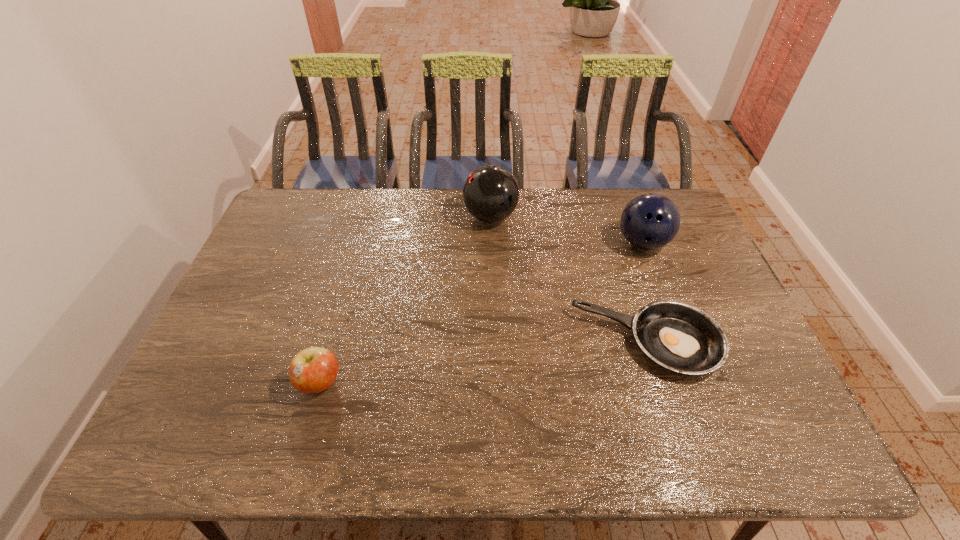
Find the location of a particular element. Image resolution: width=960 pixels, height=540 pixels. blank area located 0.200m on the left of the shortest object is located at coordinates (499, 343).

Where is `bowling ball that is at the right edge`? bowling ball that is at the right edge is located at coordinates (650, 221).

Find the location of a particular element. The image size is (960, 540). frying pan that is at the right edge is located at coordinates (680, 337).

Identify the location of object positioned at the far right corner. Image resolution: width=960 pixels, height=540 pixels. (650, 221).

The width and height of the screenshot is (960, 540). In the image, there is a desktop. In order to click on vacant space at the far edge in this screenshot , I will do `click(399, 197)`.

In the image, there is a desktop. At what (x,y) coordinates should I click in order to perform the action: click on vacant area at the near edge. Please return your answer as a coordinate pair (x, y). This screenshot has height=540, width=960. Looking at the image, I should click on (317, 428).

Where is `free spot at the left edge of the desktop`? free spot at the left edge of the desktop is located at coordinates (211, 375).

The width and height of the screenshot is (960, 540). What are the coordinates of `vacant area at the right edge` in the screenshot? It's located at (738, 330).

Identify the location of free space at the far left corner of the desktop. This screenshot has height=540, width=960. (303, 228).

The height and width of the screenshot is (540, 960). I want to click on free spot between the right bowling ball and the left bowling ball, so click(566, 230).